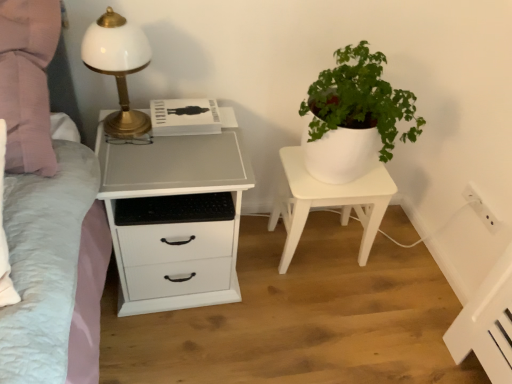
This screenshot has width=512, height=384. I want to click on vacant point to the right of white glossy table lamp at left, so click(184, 147).